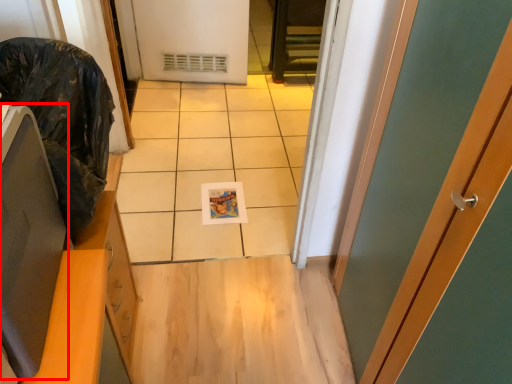
Question: From the image, what is the correct spatial relationship of computer monitor (annotated by the red box) in relation to garbage?

Choices:
 (A) right
 (B) left

Answer: (A)